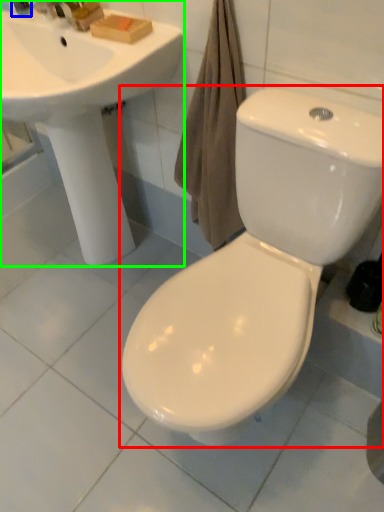
Question: Considering the real-world distances, which object is farthest from toilet (highlighted by a red box)? toiletry (highlighted by a blue box) or sink (highlighted by a green box)?

Choices:
 (A) toiletry
 (B) sink

Answer: (A)